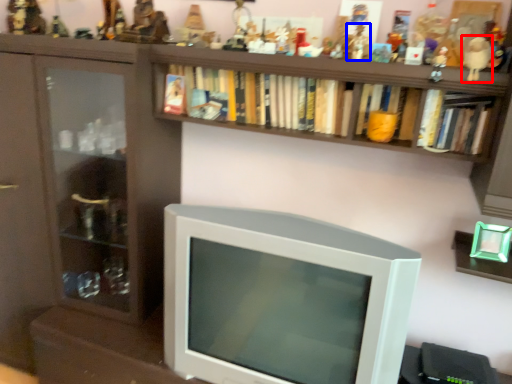
Question: Which point is further to the camera, toy (highlighted by a red box) or toy (highlighted by a blue box)?

Choices:
 (A) toy
 (B) toy

Answer: (B)